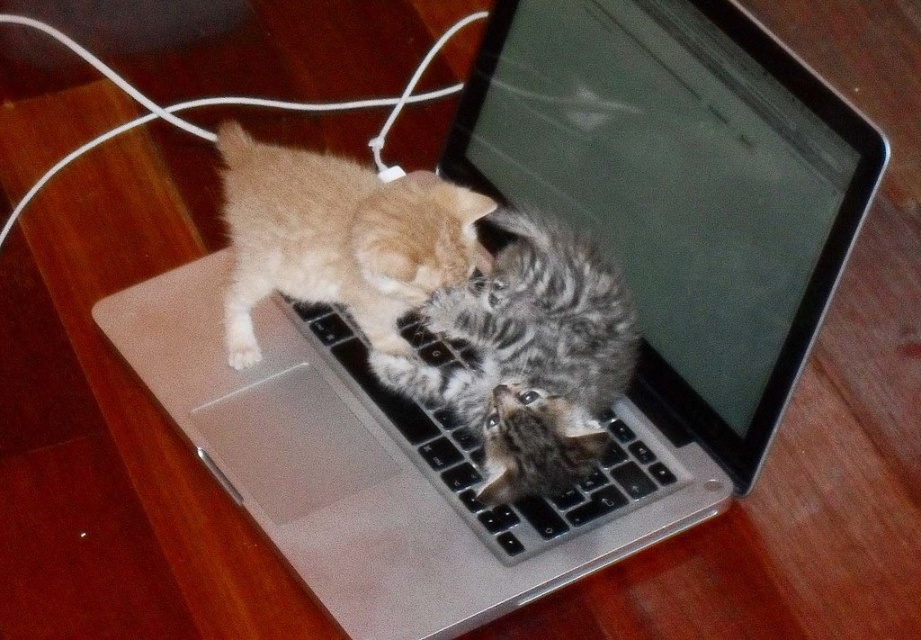
Question: Is tabby fur kitten at center closer to the viewer compared to black plastic keyboard at center?

Choices:
 (A) yes
 (B) no

Answer: (A)

Question: Considering the real-world distances, which object is farthest from the black plastic keyboard at center?

Choices:
 (A) tabby fur kitten at center
 (B) gray tabby kitten at center

Answer: (A)

Question: Which object is the farthest from the black plastic keyboard at center?

Choices:
 (A) tabby fur kitten at center
 (B) gray tabby kitten at center

Answer: (A)

Question: Which of the following is the farthest from the observer?

Choices:
 (A) gray tabby kitten at center
 (B) black plastic keyboard at center

Answer: (A)

Question: Is gray tabby kitten at center behind tabby fur kitten at center?

Choices:
 (A) no
 (B) yes

Answer: (B)

Question: Considering the relative positions of gray tabby kitten at center and tabby fur kitten at center in the image provided, where is gray tabby kitten at center located with respect to tabby fur kitten at center?

Choices:
 (A) below
 (B) above

Answer: (A)